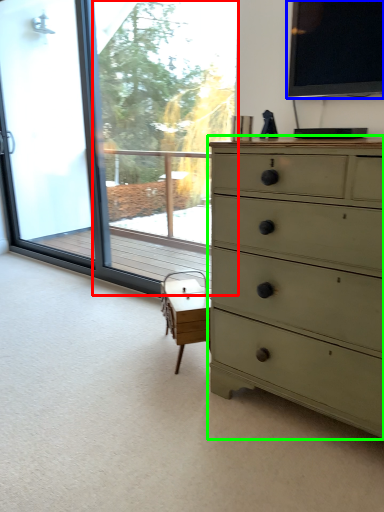
Question: Estimate the real-world distances between objects in this image. Which object is farther from window screen (highlighted by a red box), window screen (highlighted by a blue box) or chest of drawers (highlighted by a green box)?

Choices:
 (A) window screen
 (B) chest of drawers

Answer: (B)